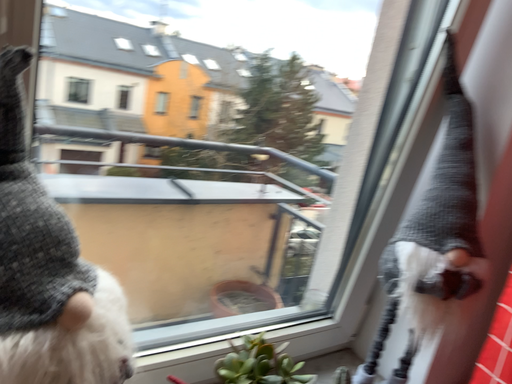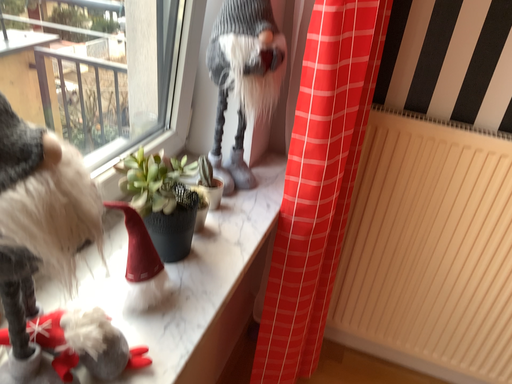
Question: How did the camera likely rotate when shooting the video?

Choices:
 (A) rotated left
 (B) rotated right

Answer: (B)